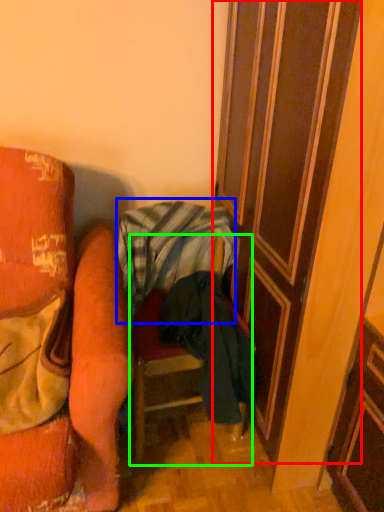
Question: Which object is positioned closest to door (highlighted by a red box)? Select from blanket (highlighted by a blue box) and furniture (highlighted by a green box).

Choices:
 (A) blanket
 (B) furniture

Answer: (A)